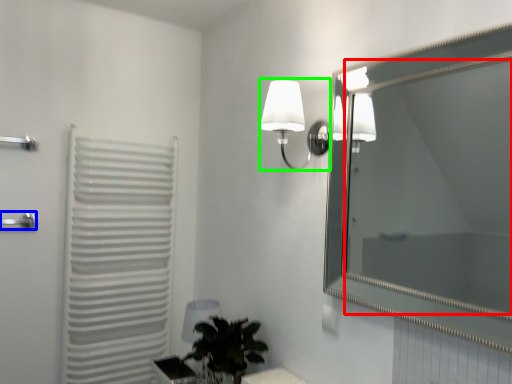
Question: Based on their relative distances, which object is farther from mirror (highlighted by a red box)? Choose from shower (highlighted by a blue box) and lamp (highlighted by a green box).

Choices:
 (A) shower
 (B) lamp

Answer: (A)